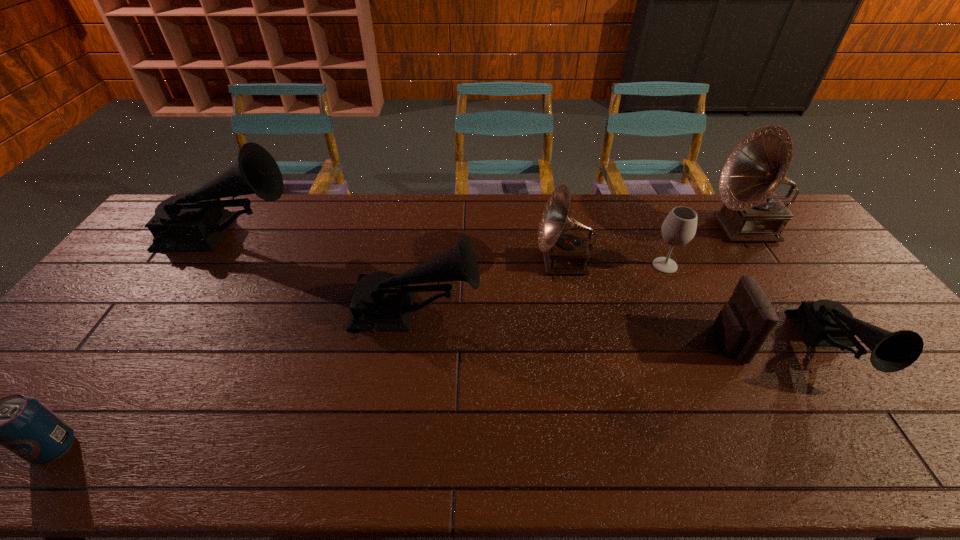
Point out which phonograph_record is positioned as the fourth nearest to the smaller brown phonograph record. Please provide its 2D coordinates. Your answer should be formatted as a tuple, i.e. [(x, y)], where the tuple contains the x and y coordinates of a point satisfying the conditions above.

[(195, 221)]

Identify which phonograph_record is the nearest to the rightmost black phonograph_record. Please provide its 2D coordinates. Your answer should be formatted as a tuple, i.e. [(x, y)], where the tuple contains the x and y coordinates of a point satisfying the conditions above.

[(752, 212)]

Locate which black phonograph_record ranks third in proximity to the bigger brown phonograph record. Please provide its 2D coordinates. Your answer should be formatted as a tuple, i.e. [(x, y)], where the tuple contains the x and y coordinates of a point satisfying the conditions above.

[(195, 221)]

Find the location of a particular element. the second closest black phonograph_record relative to the smallest black phonograph_record is located at coordinates (195, 221).